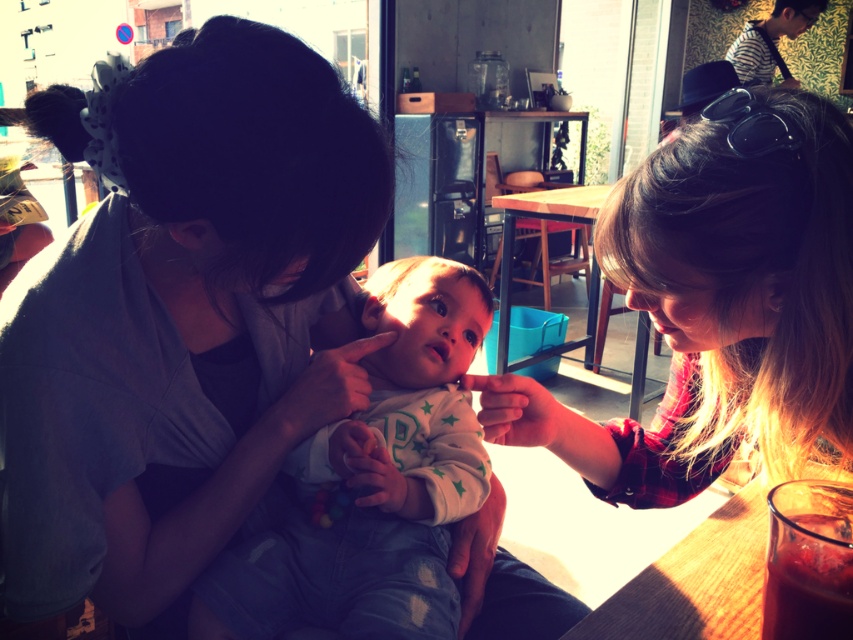
You are a server in the cafe and need to place a cup of coffee on the wooden table at lower right. Where should you place it to avoid the existing items? The coordinates of the table are from 0.8 to 1.0 on the x and y axes. The existing item is at point (695, 580). Please provide coordinates within the table area that are at least 0.05 units away from the existing item and the edges.

Place the coffee cup at coordinates 0.85, 0.85. This position is 0.04 units away from the existing item at (695, 580) and maintains a 0.05 buffer from the table edges.

You are a server in the cafe and need to place a new order of a plaid shirt at right and a translucent glass juice at lower right on the table. Which item should you place first to ensure they don t block each other?

Since the plaid shirt at right is much taller than the translucent glass juice at lower right, you should place the plaid shirt at right first to prevent it from blocking the view of the juice.